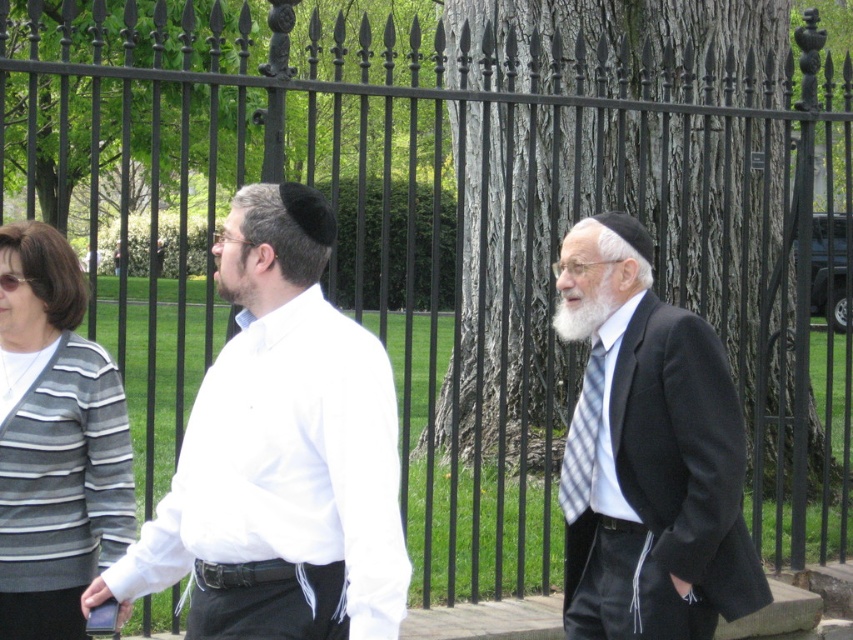
Looking at this image, you are a photographer standing on the path and want to take a photo that includes both the striped knit cardigan at left and the blue plaid tie at center. What is the minimum distance you need to move backward to ensure both items are in frame?

The striped knit cardigan at left and blue plaid tie at center are 1.67 meters apart from each other. To include both in the frame, you would need to move back until your camera can capture a field of view that spans at least 1.67 meters between them. The exact distance depends on your camera lens, but generally, moving back to a distance where the subjects appear within the frame without cropping either end should work.

You are a photographer trying to capture a group photo of the white matte shirt at center and the black wool suit at right. Since you want to ensure both subjects are in focus, you need to know their heights. Which of the two is taller?

The black wool suit at right is taller than the white matte shirt at center.